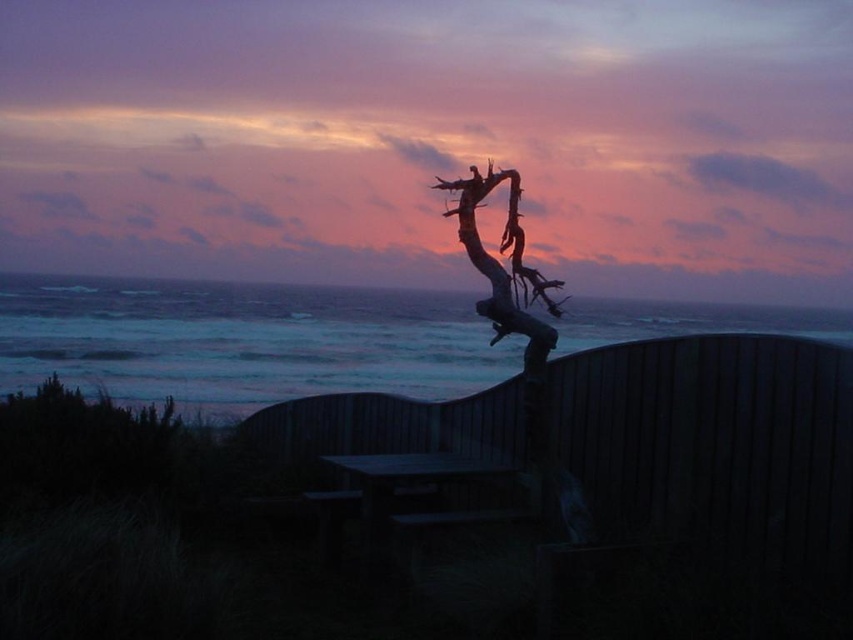
Is blue water at upper center to the right of wooden driftwood at center from the viewer's perspective?

No, blue water at upper center is not to the right of wooden driftwood at center.

Is blue water at upper center to the left of wooden driftwood at center from the viewer's perspective?

Correct, you'll find blue water at upper center to the left of wooden driftwood at center.

Locate an element on the screen. Image resolution: width=853 pixels, height=640 pixels. blue water at upper center is located at coordinates (242, 340).

At what (x,y) coordinates should I click in order to perform the action: click on blue water at upper center. Please return your answer as a coordinate pair (x, y). Looking at the image, I should click on (242, 340).